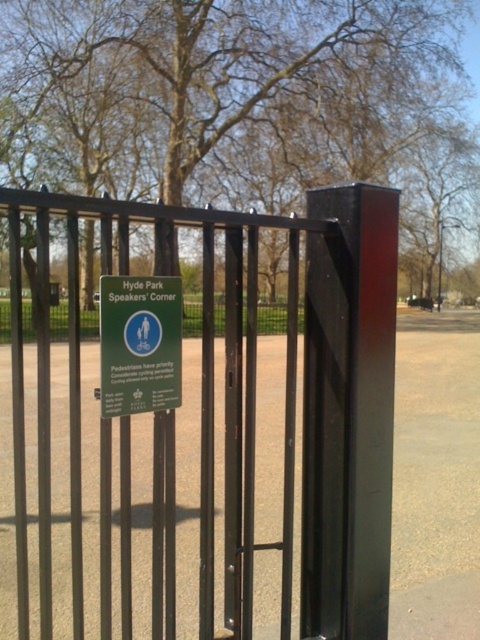
Consider the image. Is black metal fence at center smaller than green plastic sign at center?

No, black metal fence at center is not smaller than green plastic sign at center.

Is point (72, 422) positioned behind point (103, 358)?

No, (72, 422) is closer to viewer.

Identify the location of black metal fence at center. The image size is (480, 640). (201, 396).